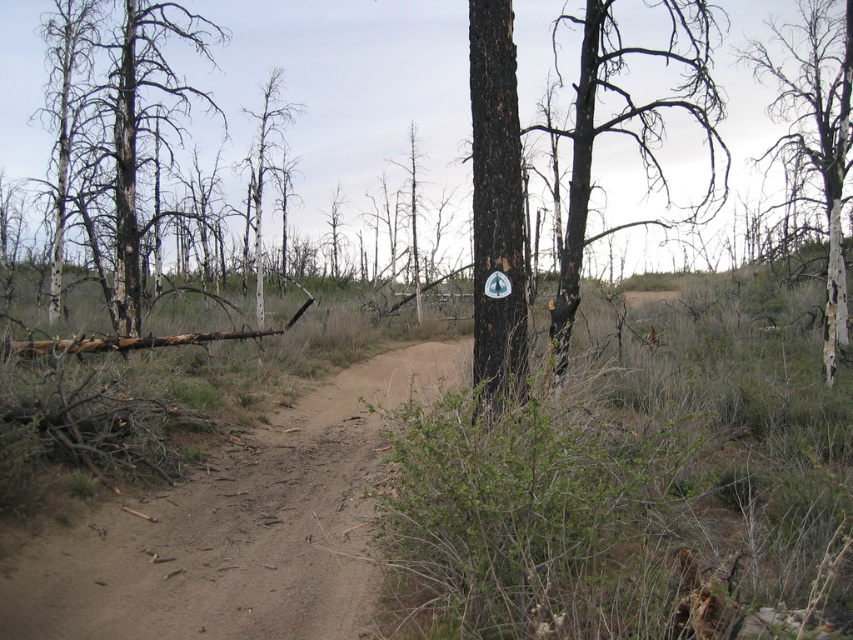
You are a hiker trying to navigate through this post fire landscape. You see a charred bark tree at upper right and a dead wood tree at center. Which tree would you need to look up to see better?

The charred bark tree at upper right is much taller than the dead wood tree at center, so you would need to look up to see the charred bark tree at upper right better.

You are a hiker who has just arrived at the post fire landscape scene. You see the point at (496, 209). What does this point represent?

The point at (496, 209) represents the black bark tree at center.

You are a hiker trying to navigate through this post fire landscape. You see the dirt path at center and the charred bark tree at upper right. Which object is closer to you?

The dirt path at center is closer to the viewer than the charred bark tree at upper right.